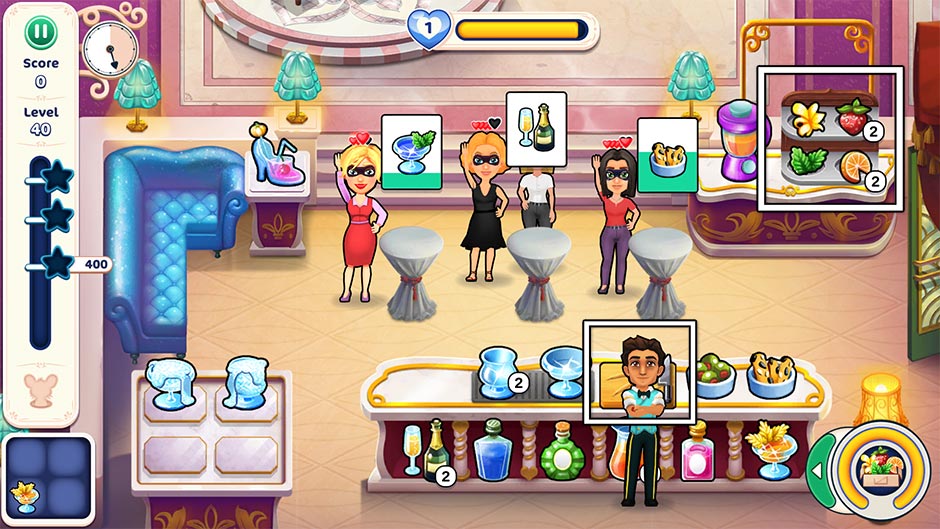
Locate an element on the screen. empty space next to blue couch is located at coordinates point(249,297).